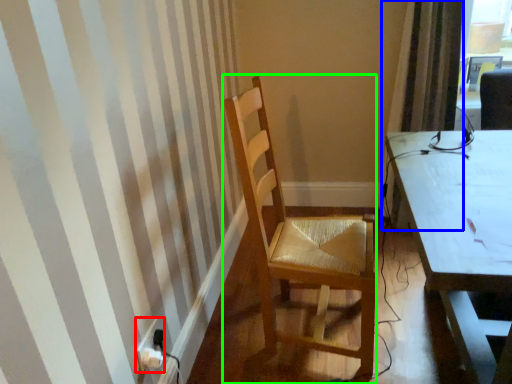
Question: Which object is positioned farthest from power plugs and sockets (highlighted by a red box)? Select from curtain (highlighted by a blue box) and chair (highlighted by a green box).

Choices:
 (A) curtain
 (B) chair

Answer: (A)